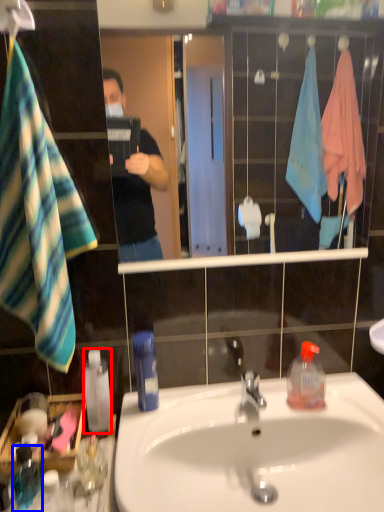
Question: Which object is closer to the camera taking this photo, bottle (highlighted by a red box) or bottle (highlighted by a blue box)?

Choices:
 (A) bottle
 (B) bottle

Answer: (B)